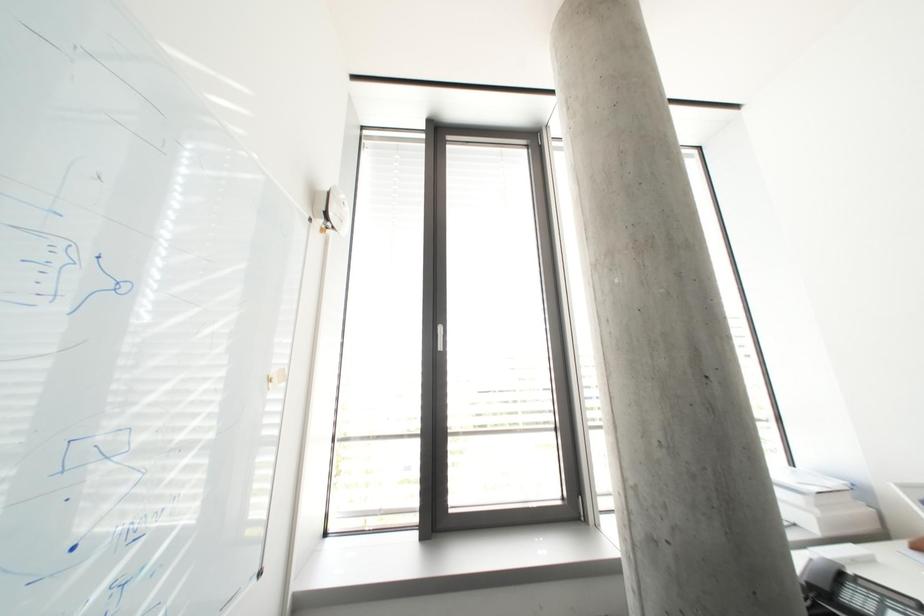
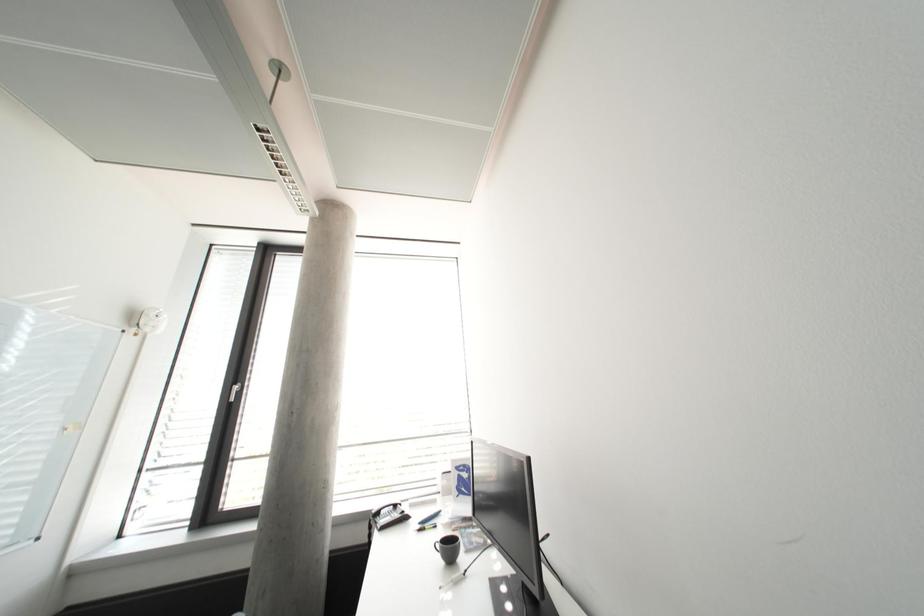
In a continuous first-person perspective shot, in which direction is the camera moving?

The cameraman moved toward right, backward.